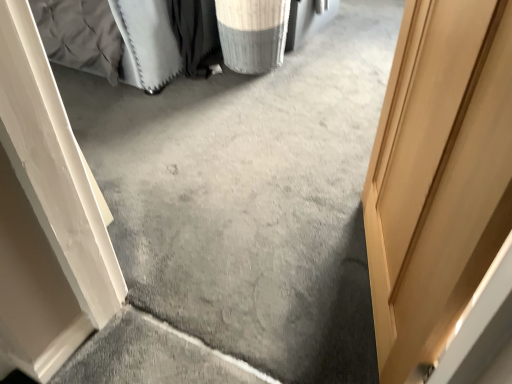
Question: Is white textured laundry basket at upper center to the left or to the right of light brown wooden door at right in the image?

Choices:
 (A) right
 (B) left

Answer: (B)

Question: Considering the positions of white textured laundry basket at upper center and light brown wooden door at right in the image, is white textured laundry basket at upper center wider or thinner than light brown wooden door at right?

Choices:
 (A) thin
 (B) wide

Answer: (B)

Question: From the image's perspective, is white textured laundry basket at upper center positioned above or below light brown wooden door at right?

Choices:
 (A) above
 (B) below

Answer: (A)

Question: Is light brown wooden door at right spatially inside white textured laundry basket at upper center, or outside of it?

Choices:
 (A) outside
 (B) inside

Answer: (A)

Question: Based on their sizes in the image, would you say light brown wooden door at right is bigger or smaller than white textured laundry basket at upper center?

Choices:
 (A) small
 (B) big

Answer: (B)

Question: In the image, is light brown wooden door at right positioned in front of or behind white textured laundry basket at upper center?

Choices:
 (A) front
 (B) behind

Answer: (A)

Question: Considering the positions of point (415, 0) and point (273, 56), is point (415, 0) closer or farther from the camera than point (273, 56)?

Choices:
 (A) farther
 (B) closer

Answer: (B)